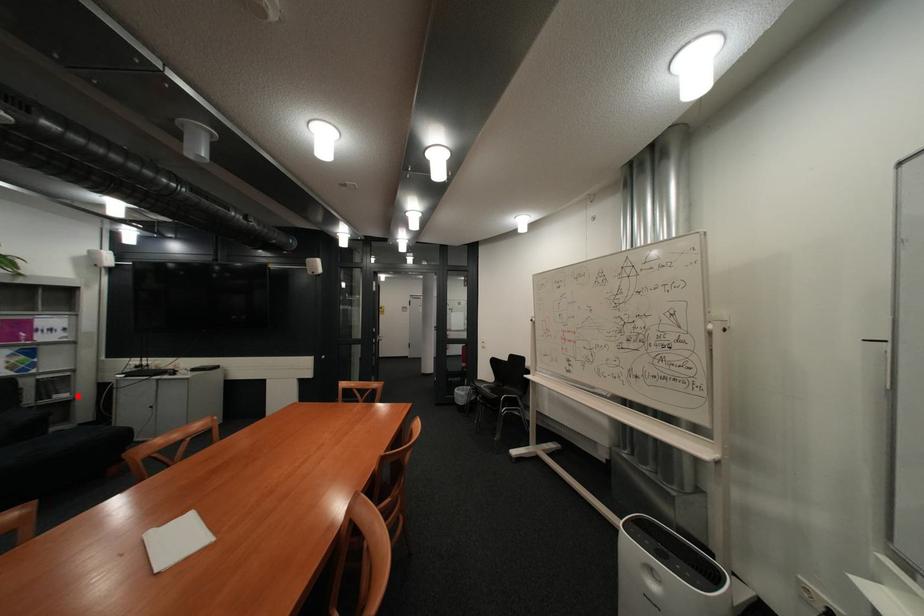
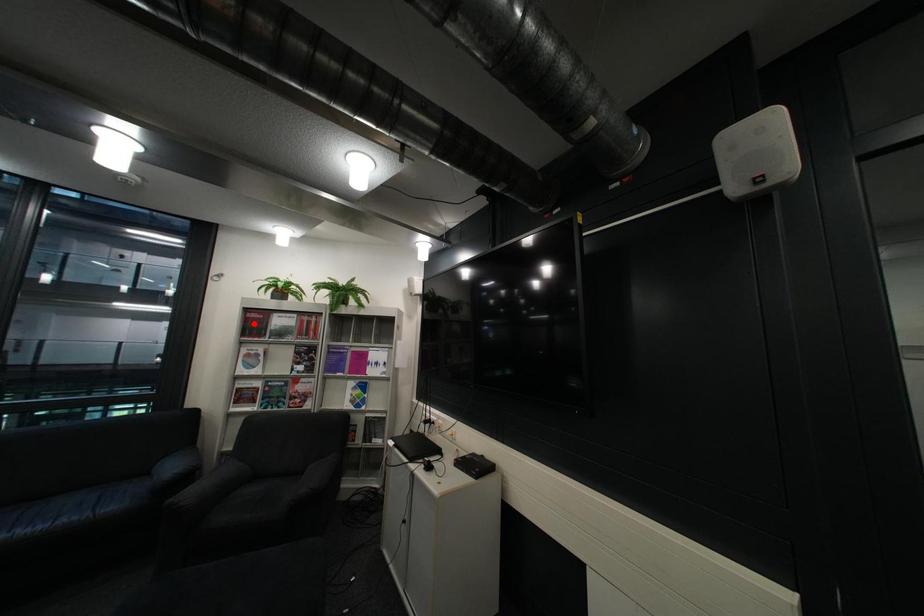
I am providing you with two images of the same scene from different viewpoints. A red point is marked on the first image and another point is marked on the second image. Are the points marked in image1 and image2 representing the same 3D position?

No